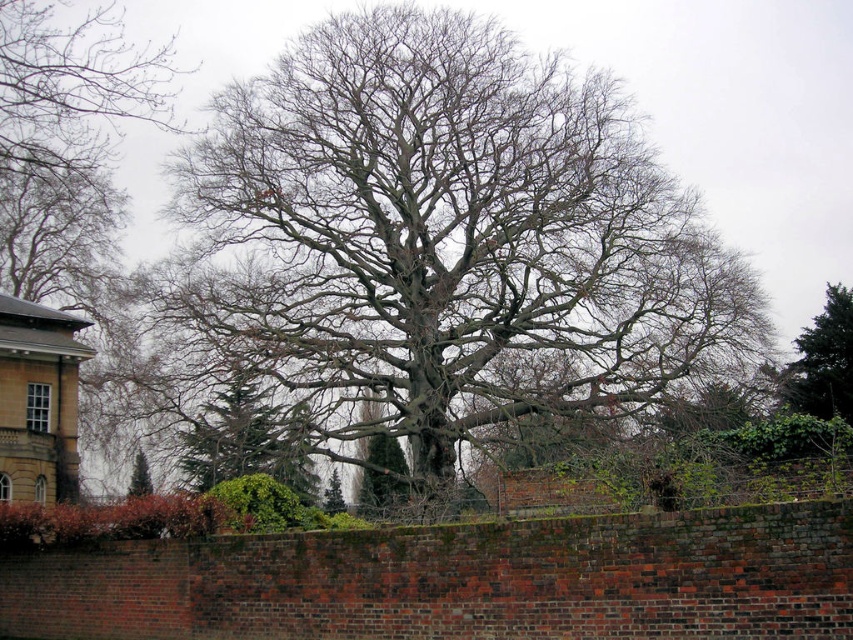
Does bare branches at center lie in front of green textured pine tree at center?

That is True.

Can you confirm if bare branches at center is positioned to the left of green textured pine tree at center?

No, bare branches at center is not to the left of green textured pine tree at center.

Is point (558, 372) closer to camera compared to point (144, 486)?

That is True.

Where is `bare branches at center`? The image size is (853, 640). bare branches at center is located at coordinates (444, 240).

Is green textured tree at center further to camera compared to green leafy tree at upper right?

That is False.

Consider the image. Can you confirm if green textured tree at center is thinner than green leafy tree at upper right?

Correct, green textured tree at center's width is less than green leafy tree at upper right's.

Where is `green textured tree at center`? The width and height of the screenshot is (853, 640). green textured tree at center is located at coordinates (247, 440).

You are a GUI agent. You are given a task and a screenshot of the screen. Output one action in this format:
    pyautogui.click(x=<x>, y=<y>)
    Task: Click on the green textured tree at center
    Image resolution: width=853 pixels, height=640 pixels.
    Given the screenshot: What is the action you would take?
    pyautogui.click(x=247, y=440)

Is bare branches at center taller than green leafy tree at upper right?

Correct, bare branches at center is much taller as green leafy tree at upper right.

Can you confirm if bare branches at center is bigger than green leafy tree at upper right?

Indeed, bare branches at center has a larger size compared to green leafy tree at upper right.

Is point (523, 156) closer to camera compared to point (830, 326)?

That is True.

This screenshot has width=853, height=640. I want to click on bare branches at center, so click(x=444, y=240).